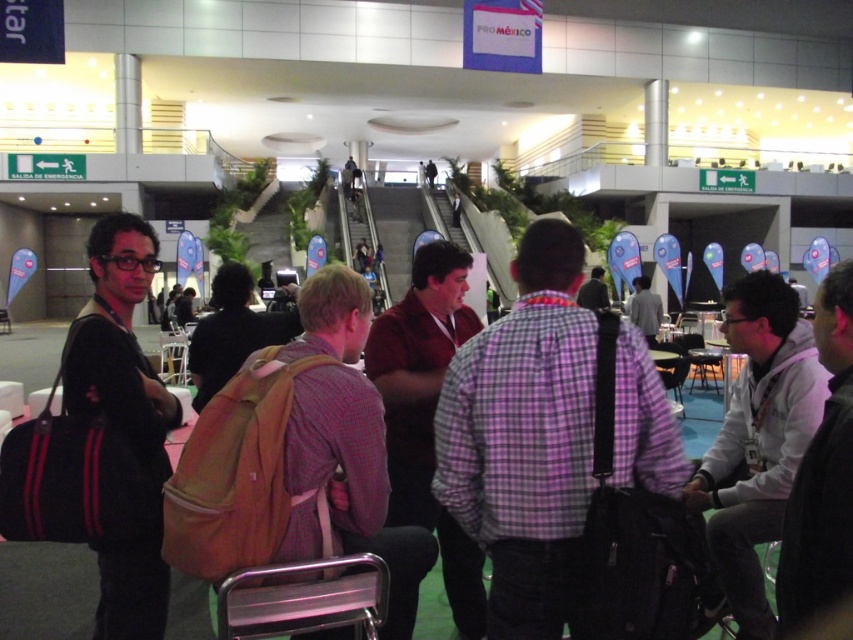
Does brown canvas backpack at center appear over plaid shirt at center?

Incorrect, brown canvas backpack at center is not positioned above plaid shirt at center.

Is brown canvas backpack at center thinner than plaid shirt at center?

Yes, brown canvas backpack at center is thinner than plaid shirt at center.

Who is more distant from viewer, (x=229, y=310) or (x=653, y=323)?

Positioned behind is point (x=653, y=323).

What are the coordinates of `brown canvas backpack at center` in the screenshot? It's located at (231, 332).

Who is positioned more to the left, brown fabric backpack at center or light gray shirt at center?

brown fabric backpack at center is more to the left.

Image resolution: width=853 pixels, height=640 pixels. What do you see at coordinates (344, 448) in the screenshot?
I see `brown fabric backpack at center` at bounding box center [344, 448].

Locate an element on the screen. This screenshot has width=853, height=640. brown fabric backpack at center is located at coordinates (344, 448).

Is purple checkered shirt at center wider than metallic silver chair at lower center?

Correct, the width of purple checkered shirt at center exceeds that of metallic silver chair at lower center.

Is purple checkered shirt at center above metallic silver chair at lower center?

Yes.

In order to click on purple checkered shirt at center in this screenshot , I will do `click(525, 440)`.